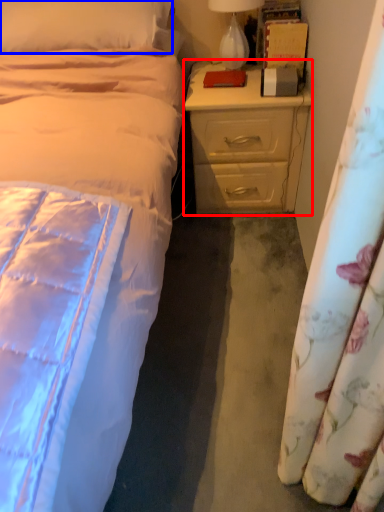
Question: Which object is further to the camera taking this photo, nightstand (highlighted by a red box) or pillow (highlighted by a blue box)?

Choices:
 (A) nightstand
 (B) pillow

Answer: (A)